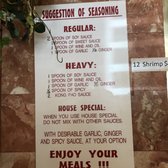
Find the location of a particular element. The width and height of the screenshot is (168, 168). brown tiled background is located at coordinates (151, 126).